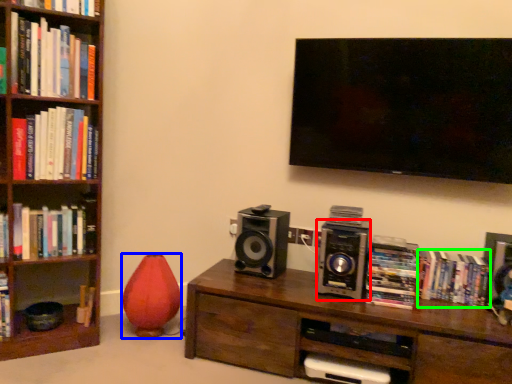
Question: Which object is positioned closest to speaker (highlighted by a red box)? Select from vase (highlighted by a blue box) and book (highlighted by a green box).

Choices:
 (A) vase
 (B) book

Answer: (B)